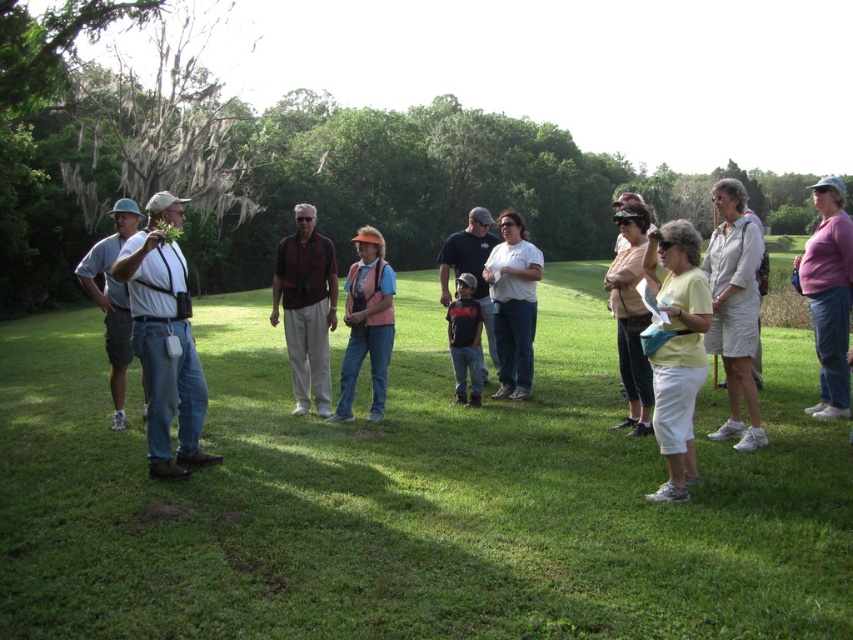
Is denim jeans at left to the right of white cotton shorts at right from the viewer's perspective?

No, denim jeans at left is not to the right of white cotton shorts at right.

From the picture: Does denim jeans at left have a greater width compared to white cotton shorts at right?

In fact, denim jeans at left might be narrower than white cotton shorts at right.

Between point (178, 397) and point (741, 186), which one is positioned in front?

Point (178, 397)

At what (x,y) coordinates should I click in order to perform the action: click on denim jeans at left. Please return your answer as a coordinate pair (x, y). Looking at the image, I should click on (164, 339).

Based on the photo, does yellow fabric purse at center appear on the left side of dark blue t-shirt at center?

Incorrect, yellow fabric purse at center is not on the left side of dark blue t-shirt at center.

Is yellow fabric purse at center thinner than dark blue t-shirt at center?

In fact, yellow fabric purse at center might be wider than dark blue t-shirt at center.

This screenshot has width=853, height=640. What are the coordinates of `yellow fabric purse at center` in the screenshot? It's located at (677, 349).

Find the location of `yellow fabric purse at center`. yellow fabric purse at center is located at coordinates (677, 349).

Between point (683, 472) and point (445, 282), which one is positioned in front?

Point (683, 472)

Can you confirm if yellow fabric purse at center is positioned to the left of dark blue shirt at center?

No, yellow fabric purse at center is not to the left of dark blue shirt at center.

The height and width of the screenshot is (640, 853). Find the location of `yellow fabric purse at center`. yellow fabric purse at center is located at coordinates (677, 349).